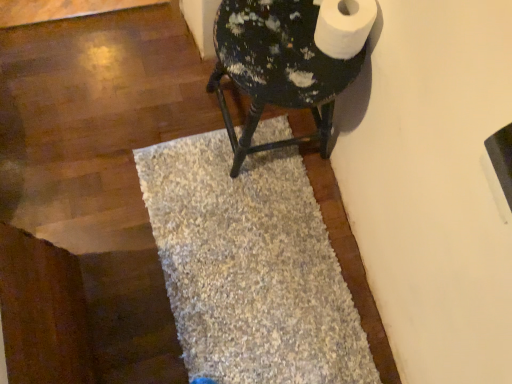
At what (x,y) coordinates should I click in order to perform the action: click on free space to the left of white matte toilet paper at upper right. Please return your answer as a coordinate pair (x, y). Image resolution: width=512 pixels, height=384 pixels. Looking at the image, I should click on (266, 28).